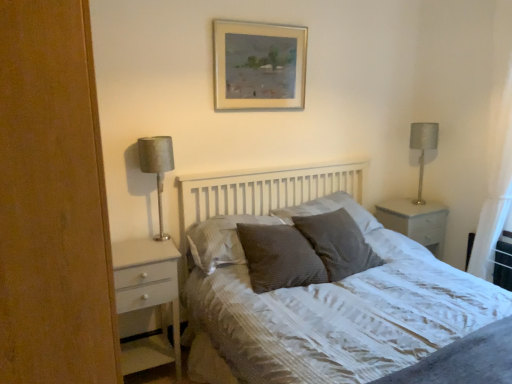
The width and height of the screenshot is (512, 384). I want to click on empty space that is ontop of white glossy nightstand at right (from a real-world perspective), so click(x=407, y=207).